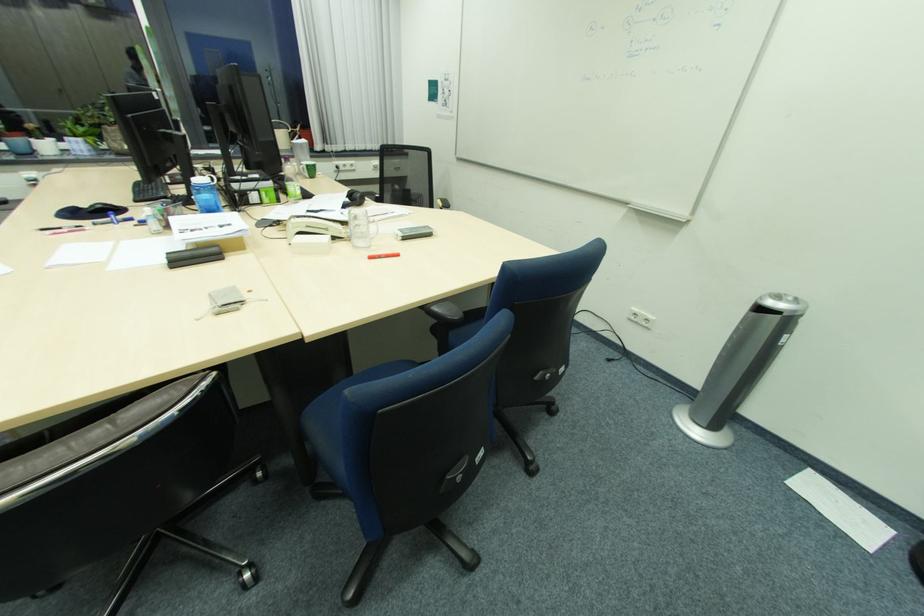
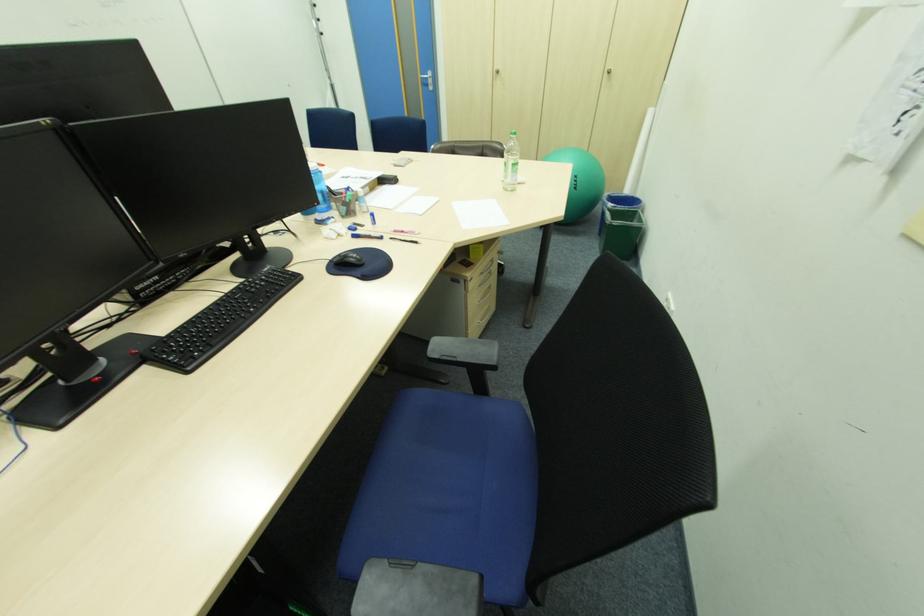
Question: I am providing you with two images of the same scene from different viewpoints. Which of the following objects are not visible in image2?

Choices:
 (A) taped cardboard box
 (B) clear glass mug
 (C) blue pen
 (D) black chair armrest

Answer: (B)